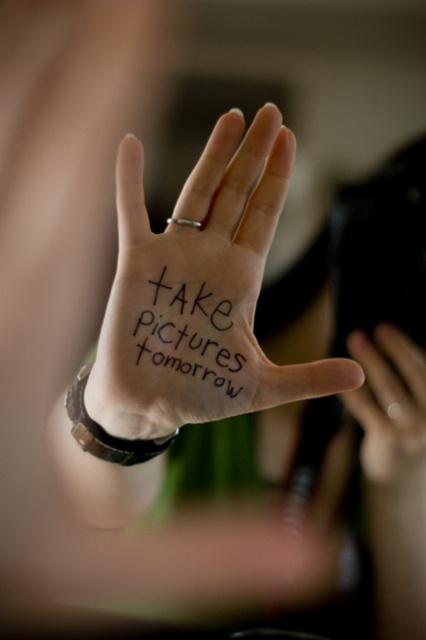
You are a photographer planning to take a close up shot of the hand in the image. The camera frame can only accommodate objects up to the width of the smooth skin hand at center. Will the white smooth palm at center fit within the frame?

The white smooth palm at center might be wider than smooth skin hand at center, so there is a possibility that it may not fit within the frame if the camera is set to the width of the smooth skin hand at center.

In the scene shown: You are a photographer planning to take pictures tomorrow. You see the message on the hand. Is the black ink writing at center positioned higher than the smooth skin hand at center?

The black ink writing at center is located above the smooth skin hand at center, so yes, it is positioned higher.